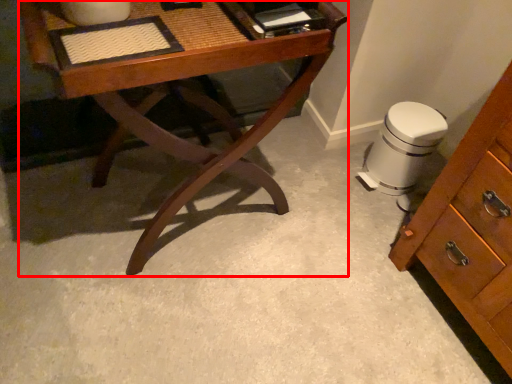
Question: From the image's perspective, where is desk (annotated by the red box) located in relation to swivel chair in the image?

Choices:
 (A) above
 (B) below

Answer: (A)